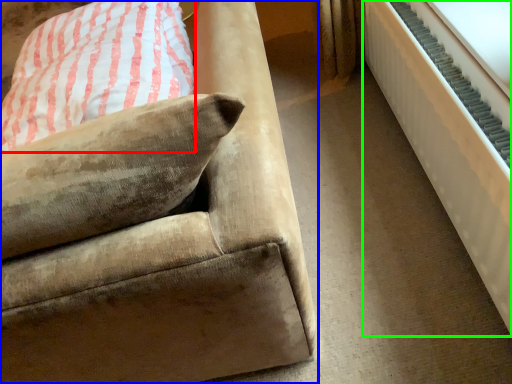
Question: Based on their relative distances, which object is nearer to pillow (highlighted by a red box)? Choose from studio couch (highlighted by a blue box) and radiator (highlighted by a green box).

Choices:
 (A) studio couch
 (B) radiator

Answer: (A)